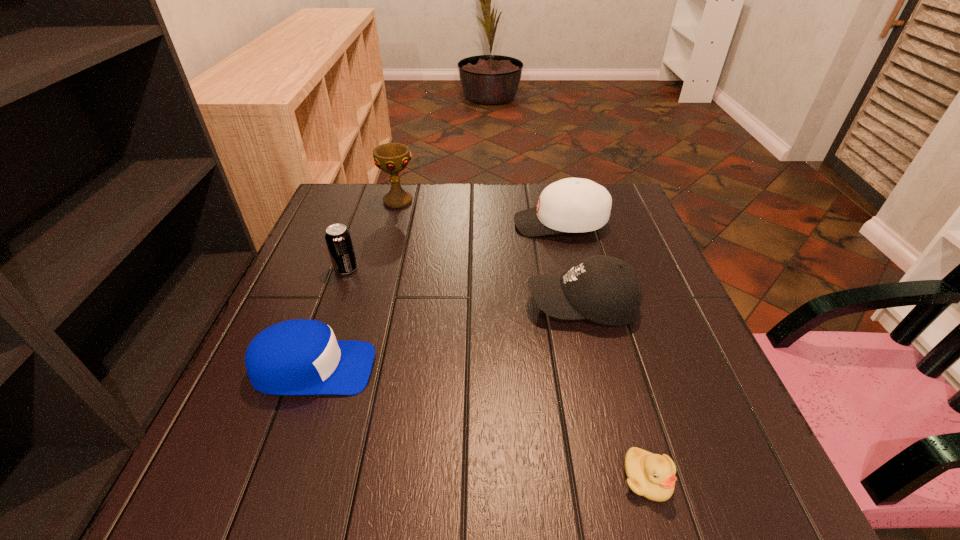
In order to click on free space between the tallest object and the leftmost baseball cap in this screenshot , I will do `click(355, 285)`.

Locate an element on the screen. vacant region between the farthest baseball cap and the second shortest object is located at coordinates (437, 296).

You are a GUI agent. You are given a task and a screenshot of the screen. Output one action in this format:
    pyautogui.click(x=<x>, y=<y>)
    Task: Click on the vacant area that lies between the tallest object and the shortest baseball cap
    Image resolution: width=960 pixels, height=540 pixels.
    Given the screenshot: What is the action you would take?
    pyautogui.click(x=355, y=285)

Find the location of a particular element. The height and width of the screenshot is (540, 960). free point between the fourth nearest object and the fifth farthest object is located at coordinates (329, 319).

Identify the location of the closest object to the soda can. This screenshot has width=960, height=540. (295, 357).

Select which object appears as the second closest to the farthest baseball cap. Please provide its 2D coordinates. Your answer should be formatted as a tuple, i.e. [(x, y)], where the tuple contains the x and y coordinates of a point satisfying the conditions above.

[(392, 158)]

You are a GUI agent. You are given a task and a screenshot of the screen. Output one action in this format:
    pyautogui.click(x=<x>, y=<y>)
    Task: Click on the baseball cap that is the closest to the nearest baseball cap
    
    Given the screenshot: What is the action you would take?
    pyautogui.click(x=606, y=290)

This screenshot has height=540, width=960. In order to click on baseball cap object that ranks as the closest to the fourth farthest object in this screenshot , I will do `click(574, 205)`.

Identify the location of free spot that satisfies the following two spatial constraints: 1. on the back side of the soda can; 2. on the left side of the tallest object. This screenshot has width=960, height=540. (371, 201).

You are a GUI agent. You are given a task and a screenshot of the screen. Output one action in this format:
    pyautogui.click(x=<x>, y=<y>)
    Task: Click on the free space that satisfies the following two spatial constraints: 1. on the front-facing side of the farthest baseball cap; 2. on the front side of the third farthest object
    
    Given the screenshot: What is the action you would take?
    pyautogui.click(x=571, y=269)